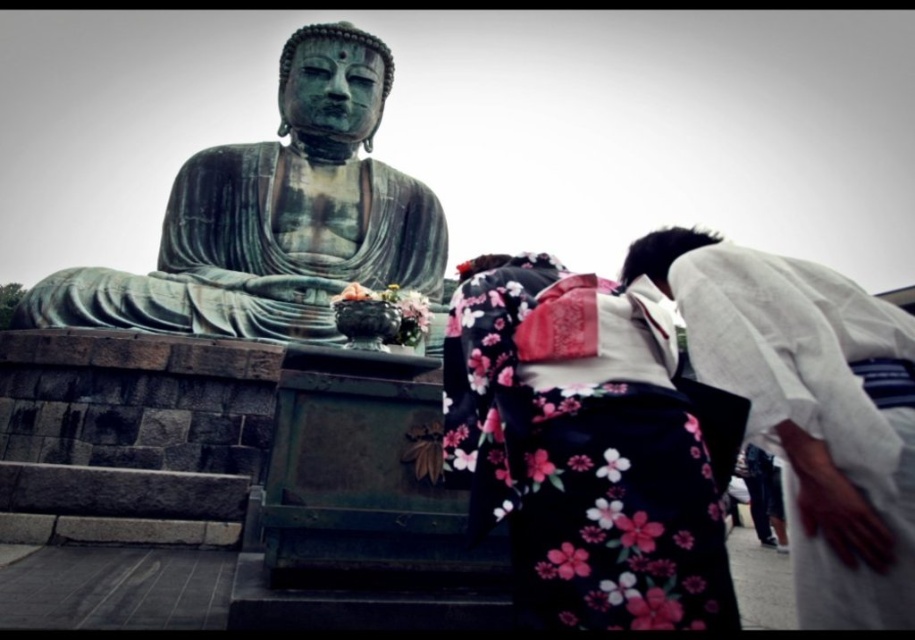
Question: Which point is closer to the camera?

Choices:
 (A) (184, 282)
 (B) (824, 428)

Answer: (B)

Question: Does floral kimono at center appear under green patina statue at center?

Choices:
 (A) no
 (B) yes

Answer: (B)

Question: Which point appears closest to the camera in this image?

Choices:
 (A) (675, 474)
 (B) (762, 273)

Answer: (A)

Question: In this image, where is green patina statue at center located relative to white cotton kimono at lower right?

Choices:
 (A) above
 (B) below

Answer: (A)

Question: Based on their relative distances, which object is farther from the white cotton kimono at lower right?

Choices:
 (A) green patina statue at center
 (B) floral kimono at center

Answer: (A)

Question: Is floral kimono at center positioned before green patina statue at center?

Choices:
 (A) no
 (B) yes

Answer: (B)